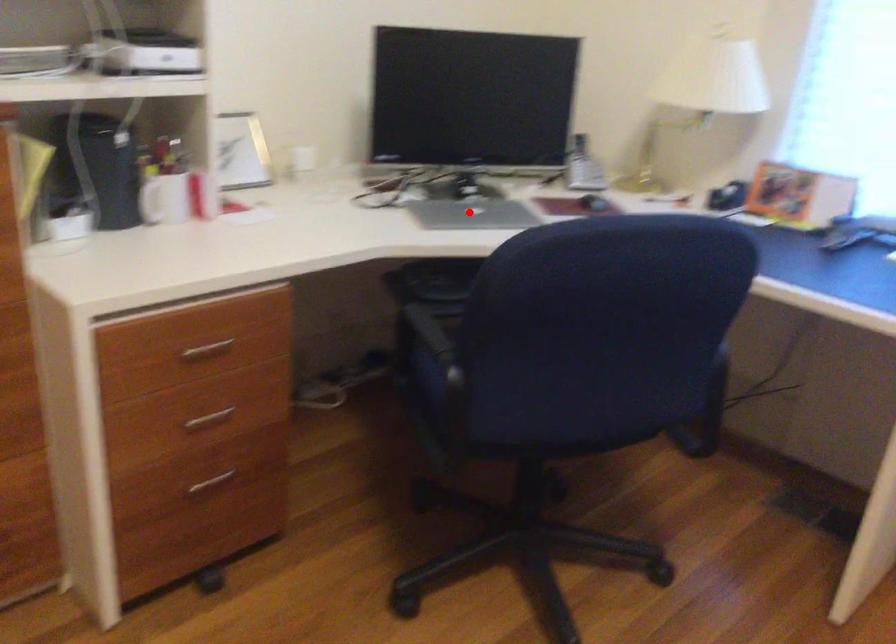
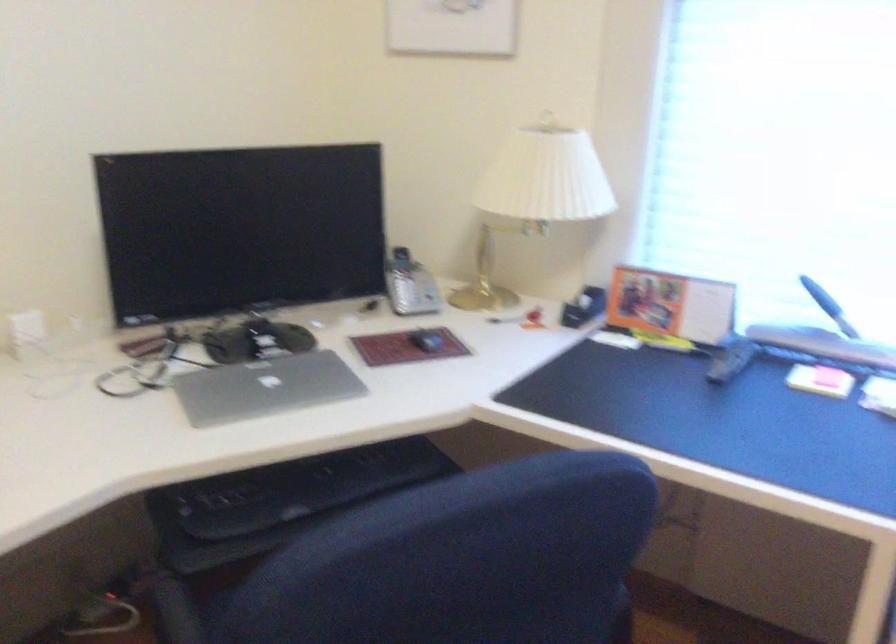
Where in the second image is the point corresponding to the highlighted location from the first image?

(264, 386)